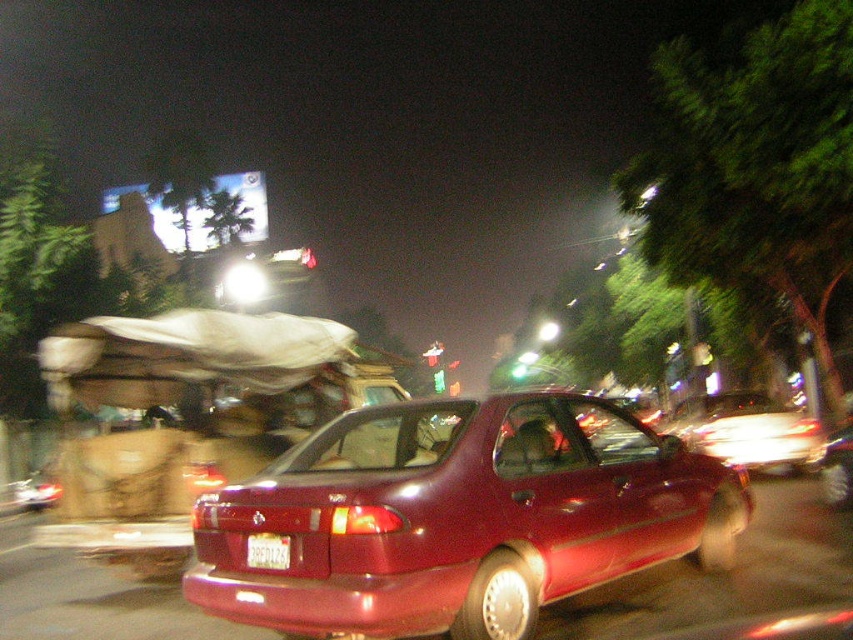
Question: Is matte red car at center in front of white plastic license plate at rear?

Choices:
 (A) no
 (B) yes

Answer: (B)

Question: Which of the following is the farthest from the observer?

Choices:
 (A) white plastic license plate at rear
 (B) matte red car at center

Answer: (A)

Question: Which object is closer to the camera taking this photo?

Choices:
 (A) white plastic license plate at rear
 (B) matte red car at center

Answer: (B)

Question: Is matte red car at center wider than white plastic license plate at rear?

Choices:
 (A) no
 (B) yes

Answer: (B)

Question: Can you confirm if matte red car at center is positioned to the left of white plastic license plate at rear?

Choices:
 (A) no
 (B) yes

Answer: (A)